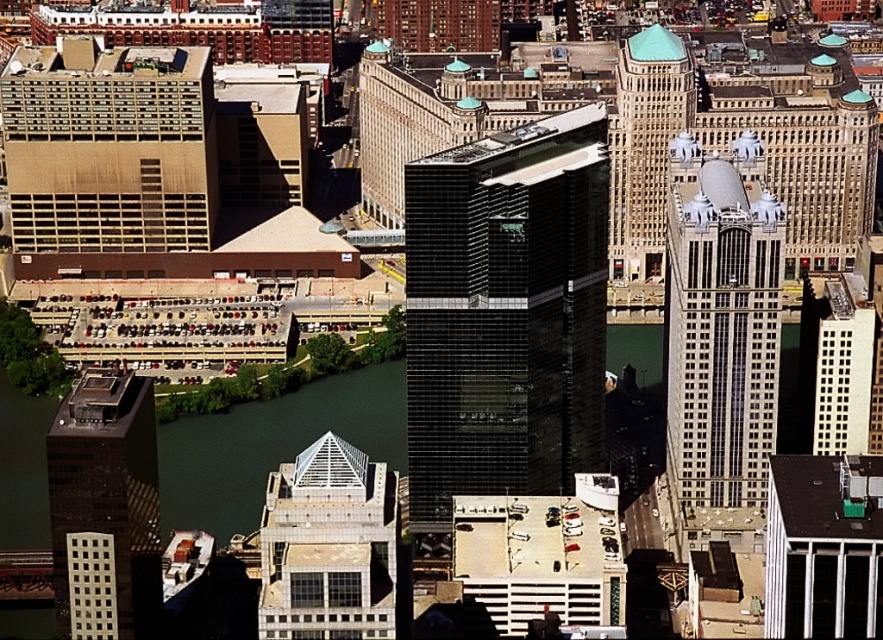
You are a city planner reviewing this urban layout. You need to determine which of the two buildings, the brown textured building at left or the matte glass skyscraper at upper right, has a larger footprint. Based on the aerial view provided, which one occupies more ground space?

The brown textured building at left is bigger than the matte glass skyscraper at upper right, so it occupies more ground space.